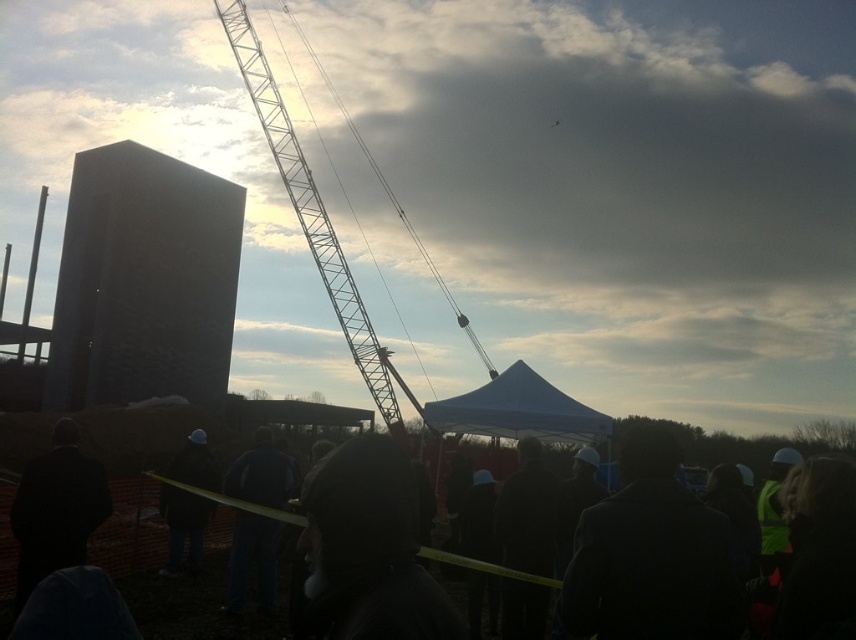
You are a photographer positioned at the edge of the construction site. You need to capture a photo that includes both the dark suit at lower left and the dark fabric jacket at center. Based on their positions and the scene described, which object is positioned closer to the left side of the image?

The dark suit at lower left is positioned closer to the left side of the image compared to the dark fabric jacket at center.

You are a safety inspector at the construction site. You notice two individuals, one wearing a dark suit at lower left and another in a dark fabric jacket at center. Which person is standing closer to the caution tape?

The dark suit at lower left is positioned over dark fabric jacket at center, meaning the dark suit at lower left is closer to the caution tape.